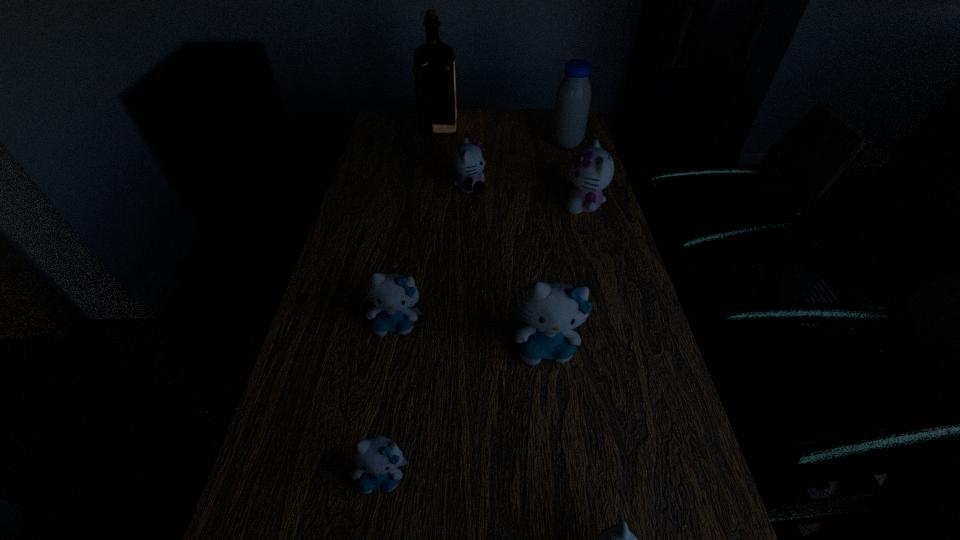
The image size is (960, 540). Identify the location of the smallest blue kitten. (377, 459).

Where is `free spot located 0.260m on the label of the tallest object`? free spot located 0.260m on the label of the tallest object is located at coordinates (525, 125).

You are a GUI agent. You are given a task and a screenshot of the screen. Output one action in this format:
    pyautogui.click(x=<x>, y=<y>)
    Task: Click on the free space located 0.100m on the back of the blue soya milk
    The image size is (960, 540).
    Given the screenshot: What is the action you would take?
    pyautogui.click(x=561, y=123)

You are a GUI agent. You are given a task and a screenshot of the screen. Output one action in this format:
    pyautogui.click(x=<x>, y=<y>)
    Task: Click on the vacant space positioned 0.250m on the front-facing side of the biggest white kitten
    Image resolution: width=960 pixels, height=540 pixels.
    Given the screenshot: What is the action you would take?
    pyautogui.click(x=481, y=205)

Locate an element on the screen. Image resolution: width=960 pixels, height=540 pixels. vacant space located 0.400m on the front-facing side of the biggest white kitten is located at coordinates (431, 205).

In order to click on vacant space located on the front-facing side of the biggest white kitten in this screenshot , I will do `click(468, 205)`.

Identify the location of free region located 0.190m on the face of the biggest blue kitten. (561, 461).

You are a GUI agent. You are given a task and a screenshot of the screen. Output one action in this format:
    pyautogui.click(x=<x>, y=<y>)
    Task: Click on the free space located on the front-facing side of the fourth kitten from right to left
    This screenshot has height=540, width=960.
    Given the screenshot: What is the action you would take?
    pyautogui.click(x=555, y=187)

Locate an element on the screen. Image resolution: width=960 pixels, height=540 pixels. vacant space positioned on the face of the second smallest blue kitten is located at coordinates (372, 473).

Identify the location of liquor located at the far edge. (434, 61).